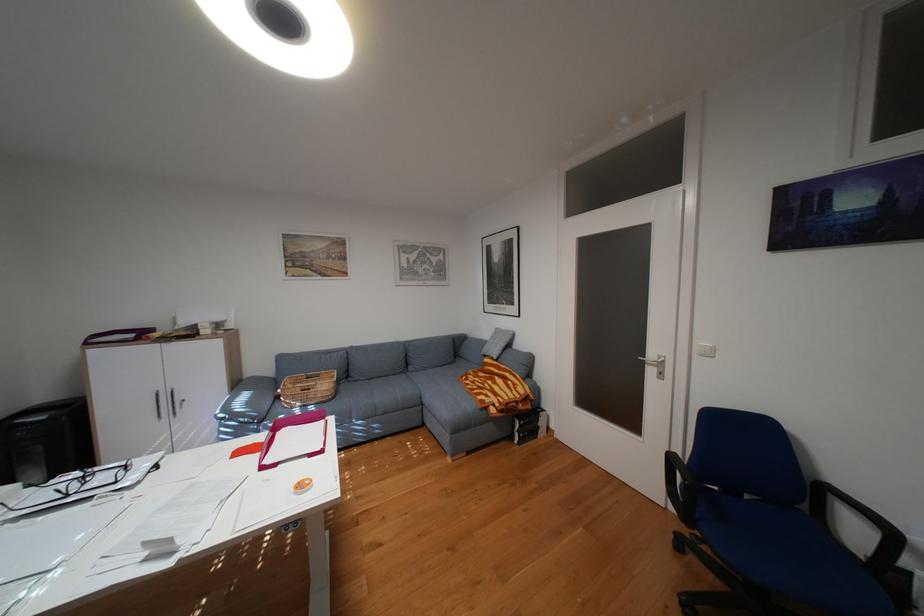
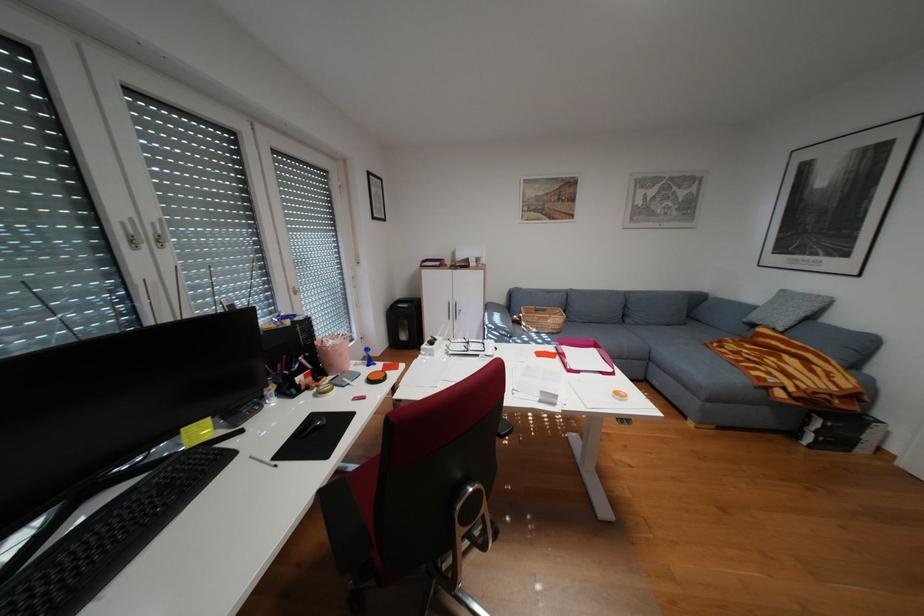
In the second image, find the point that corresponds to (x=286, y=464) in the first image.

(590, 371)